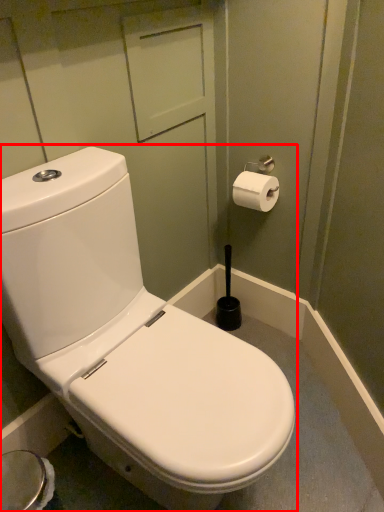
Question: From the image's perspective, where is toilet (annotated by the red box) located relative to toilet paper?

Choices:
 (A) below
 (B) above

Answer: (A)